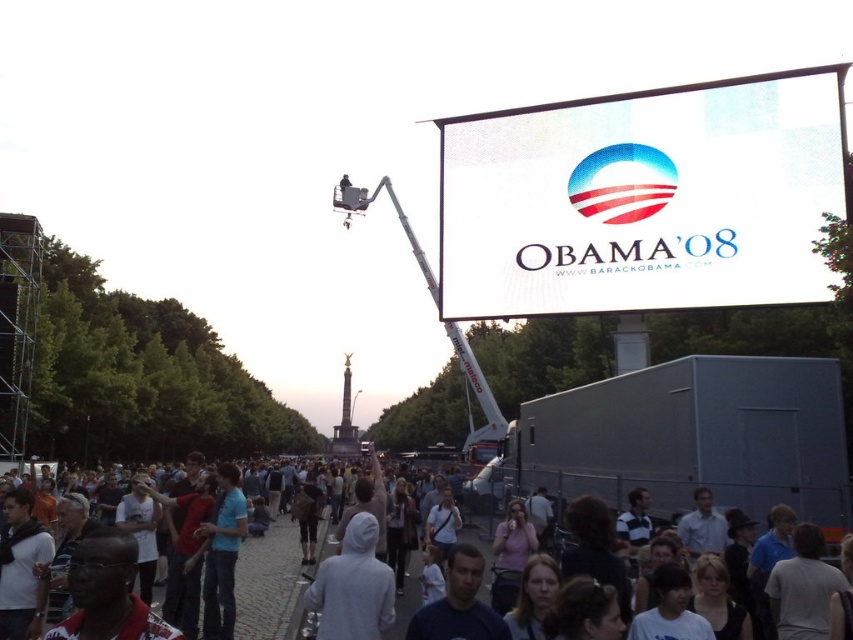
You are a photographer positioned at the center of the cobblestone street in the foreground. You want to capture a photo of the white matte billboard at upper center while ensuring the large crowd of people in the foreground doesn not block the view. Can you move to a position where the billboard is visible without obstruction?

The white matte billboard at upper center is located at point (643, 198), which is above the crowd, so yes, you can move to a higher elevation or adjust your angle to capture it without obstruction from the crowd in the foreground.

You are a photographer trying to capture a photo of the gray hoodie at center without the white matte billboard at upper center blocking the view. Can you adjust your position to do so?

The white matte billboard at upper center might be wider than gray hoodie at center, so adjusting your position might help avoid the billboard blocking the view of the gray hoodie at center.

You are a photographer trying to capture both the white matte billboard at upper center and the white hoodie at center in a single shot. Given their sizes, which object would you need to position closer to the camera to ensure both are visible clearly?

Since the white matte billboard at upper center is smaller than the white hoodie at center, you should position the white hoodie at center closer to the camera to ensure both objects are visible clearly in the photo.